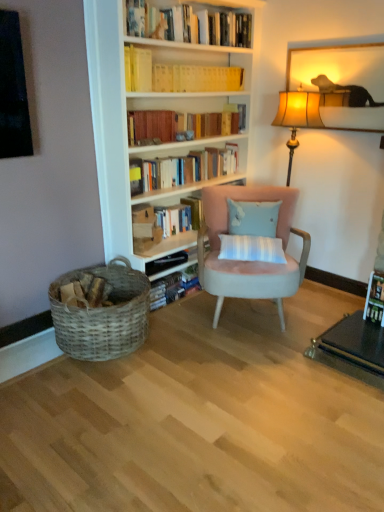
Question: In which direction should I rotate to look at hardcover book at upper center, which is counted as the third book, starting from the bottom?

Choices:
 (A) left
 (B) right

Answer: (A)

Question: From a real-world perspective, is suede pink armchair at center beneath hardcover books at center, which is counted as the first book, starting from the bottom?

Choices:
 (A) no
 (B) yes

Answer: (B)

Question: Considering the relative sizes of suede pink armchair at center and hardcover books at center, which is counted as the first book, starting from the bottom, in the image provided, is suede pink armchair at center smaller than hardcover books at center, which is counted as the first book, starting from the bottom,?

Choices:
 (A) yes
 (B) no

Answer: (B)

Question: Is suede pink armchair at center positioned beyond the bounds of hardcover books at center, which is counted as the first book, starting from the bottom?

Choices:
 (A) yes
 (B) no

Answer: (A)

Question: Is suede pink armchair at center positioned with its back to hardcover books at center, which is counted as the 5th book, starting from the top?

Choices:
 (A) no
 (B) yes

Answer: (A)

Question: From the image's perspective, is suede pink armchair at center on top of hardcover books at center, which is counted as the 5th book, starting from the top?

Choices:
 (A) yes
 (B) no

Answer: (B)

Question: Is suede pink armchair at center positioned far away from hardcover books at center, which is counted as the first book, starting from the bottom?

Choices:
 (A) yes
 (B) no

Answer: (B)

Question: Considering the relative sizes of hardcover books at upper center, placed as the 4th book when sorted from top to bottom, and wooden picture frame at upper right in the image provided, is hardcover books at upper center, placed as the 4th book when sorted from top to bottom, thinner than wooden picture frame at upper right?

Choices:
 (A) no
 (B) yes

Answer: (A)

Question: Would you consider hardcover books at upper center, placed as the 4th book when sorted from top to bottom, to be distant from wooden picture frame at upper right?

Choices:
 (A) yes
 (B) no

Answer: (A)

Question: Is hardcover books at upper center, the 2th book in the bottom-to-top sequence, outside wooden picture frame at upper right?

Choices:
 (A) no
 (B) yes

Answer: (B)

Question: Considering the relative positions of hardcover books at upper center, the 2th book in the bottom-to-top sequence, and wooden picture frame at upper right in the image provided, is hardcover books at upper center, the 2th book in the bottom-to-top sequence, in front of wooden picture frame at upper right?

Choices:
 (A) no
 (B) yes

Answer: (A)

Question: Is hardcover books at upper center, the 2th book in the bottom-to-top sequence, placed right next to wooden picture frame at upper right?

Choices:
 (A) yes
 (B) no

Answer: (B)

Question: Is wooden picture frame at upper right at the back of hardcover books at upper center, placed as the 4th book when sorted from top to bottom?

Choices:
 (A) no
 (B) yes

Answer: (A)

Question: Would you say yellow paperbacks at upper center, which is the 1th book in top-to-bottom order, is part of hardcover book at upper center, which is counted as the third book, starting from the bottom,'s contents?

Choices:
 (A) no
 (B) yes

Answer: (A)